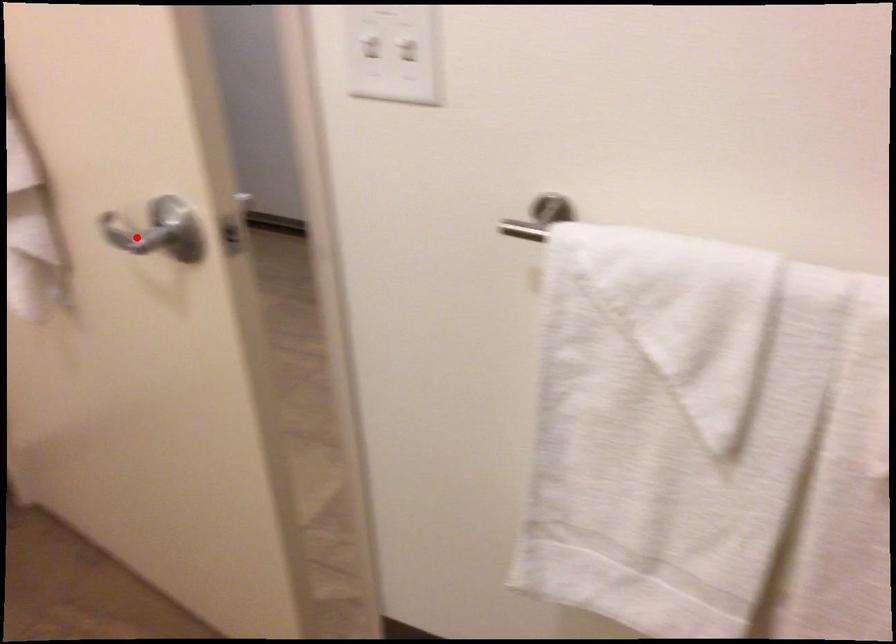
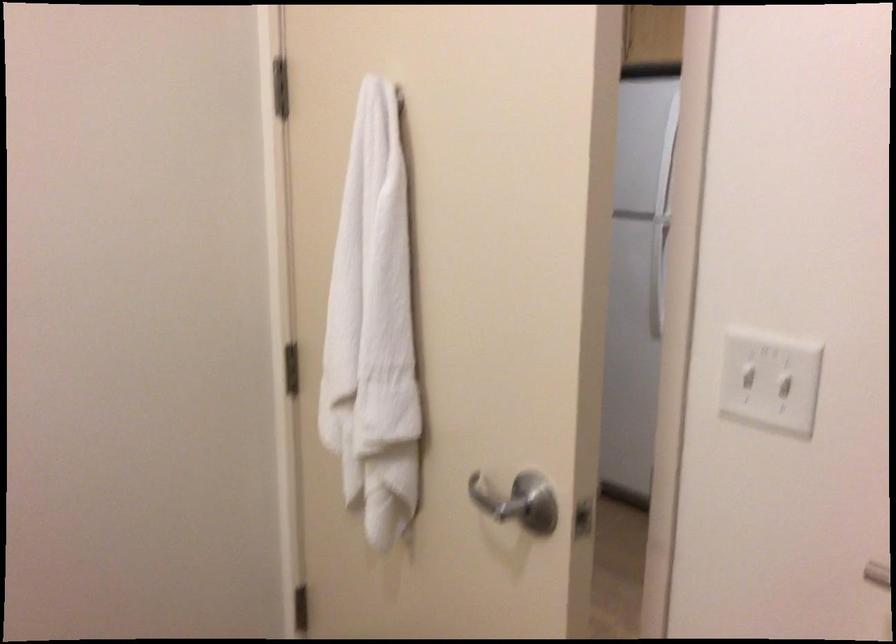
Locate, in the second image, the point that corresponds to the highlighted location in the first image.

(494, 500)